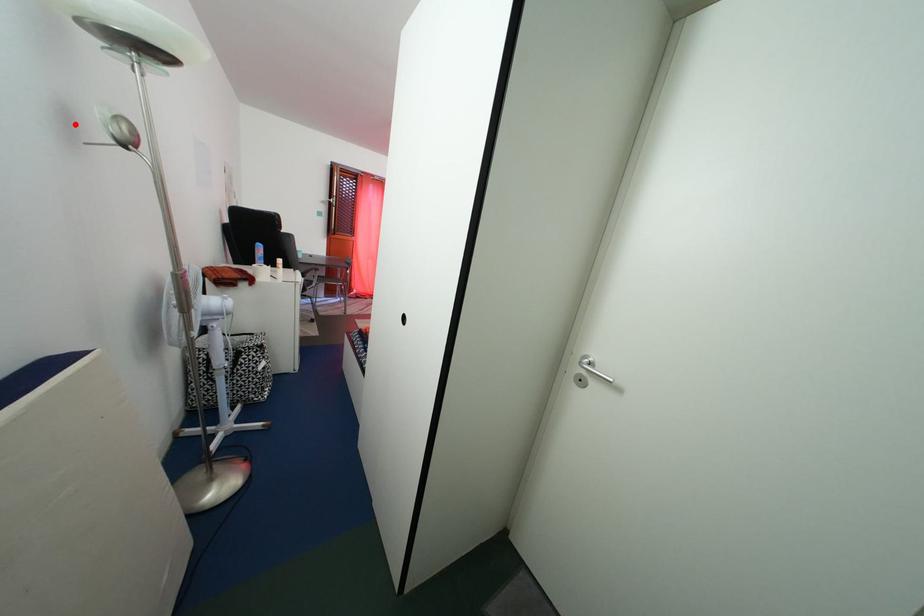
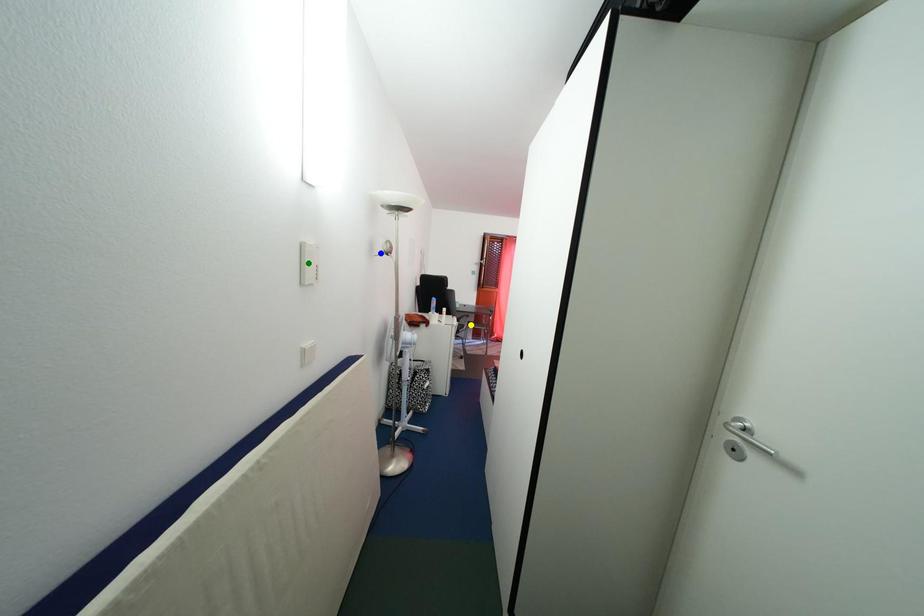
Question: I am providing you with two images of the same scene from different viewpoints. A red point is marked on the first image. You are given multiple points on the second image. Which mark in image 2 goes with the point in image 1?

Choices:
 (A) yellow point
 (B) green point
 (C) blue point

Answer: (C)